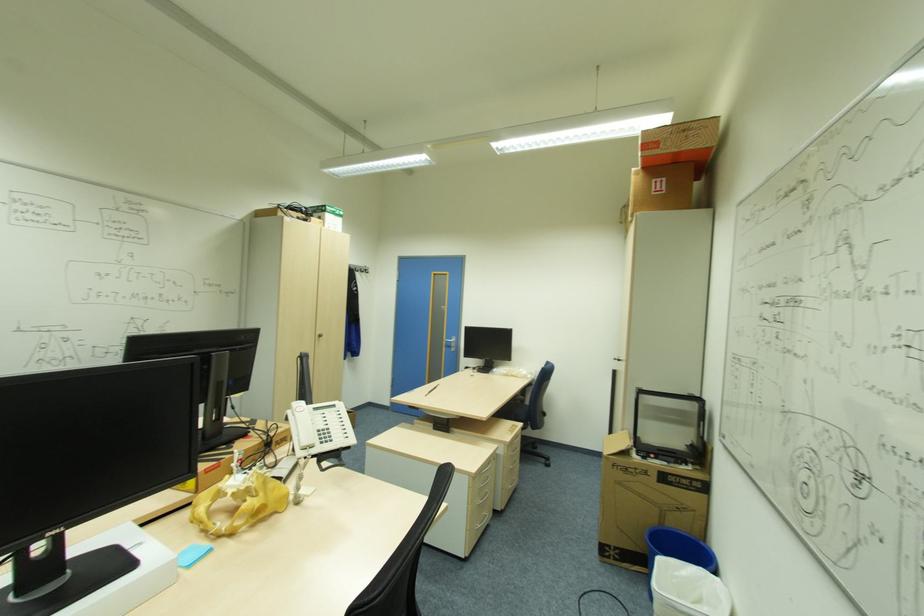
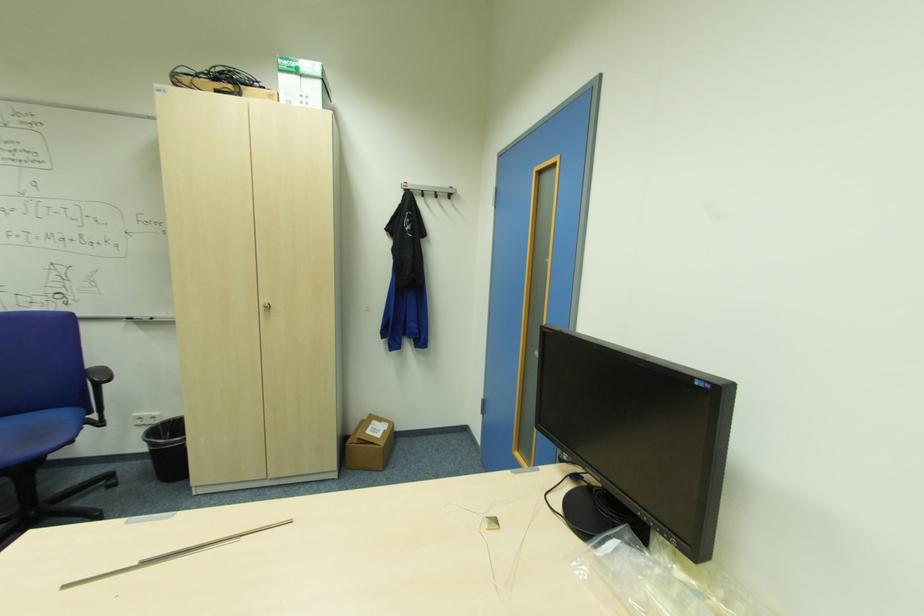
Locate, in the second image, the point that corresponds to the point at 429,395 in the first image.

(63, 589)